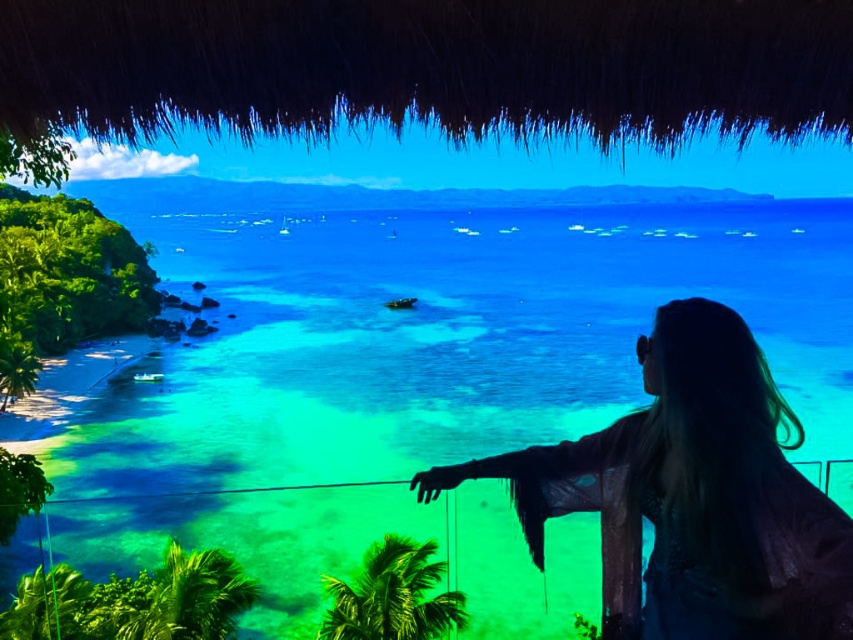
You are standing on a balcony overlooking the beach scene. You want to take a photo of both the translucent blue water at center and the silky black hair at upper right in the same frame. Based on their distance apart, will you need to zoom in or zoom out to capture both subjects?

The translucent blue water at center and silky black hair at upper right are 7.95 meters apart. To capture both in the same frame, you would need to zoom out to widen the field of view, as they are relatively far apart.

You are standing on the balcony and want to locate two specific points in the water. The first point is at coordinates point (x=328, y=403) and the second is at point (x=590, y=452). Which point is farther away from you?

Point (x=328, y=403) is behind point (x=590, y=452), so it is farther away from you.